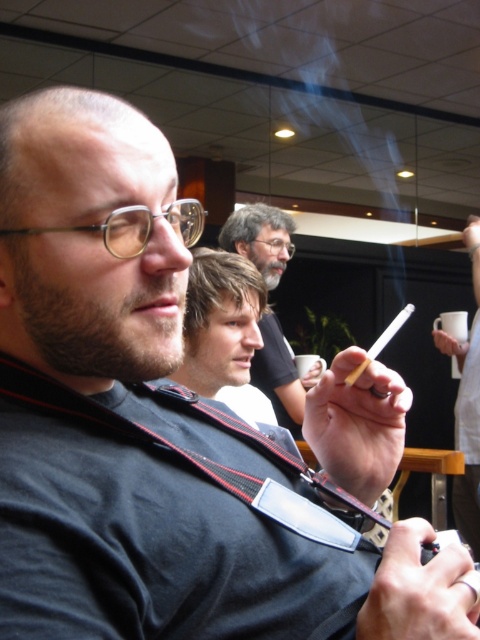
Is matte black shirt at center below white paper cigarette at center?

Actually, matte black shirt at center is above white paper cigarette at center.

Based on the photo, between matte black shirt at center and white paper cigarette at center, which one has less height?

Standing shorter between the two is white paper cigarette at center.

Between point (272, 390) and point (382, 332), which one is positioned behind?

The point (382, 332) is more distant.

Locate an element on the screen. The image size is (480, 640). matte black shirt at center is located at coordinates (280, 374).

Which is more to the right, white matte cigarette at center or white paper cigarette at center?

From the viewer's perspective, white matte cigarette at center appears more on the right side.

This screenshot has height=640, width=480. What are the coordinates of `white matte cigarette at center` in the screenshot? It's located at (467, 404).

Is point (336, 216) behind point (373, 355)?

Yes.

Which of these two, smoketransparent at upper center or white paper cigarette at center, stands taller?

smoketransparent at upper center

Who is more forward, (191, 74) or (403, 312)?

Point (403, 312)

What are the coordinates of `smoketransparent at upper center` in the screenshot? It's located at (313, 156).